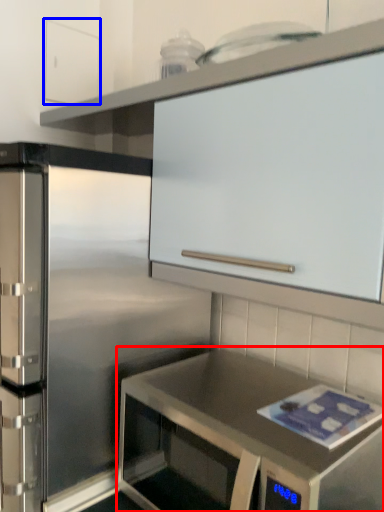
Question: Which of the following is the farthest to the observer, countertop (highlighted by a red box) or cabinetry (highlighted by a blue box)?

Choices:
 (A) countertop
 (B) cabinetry

Answer: (B)